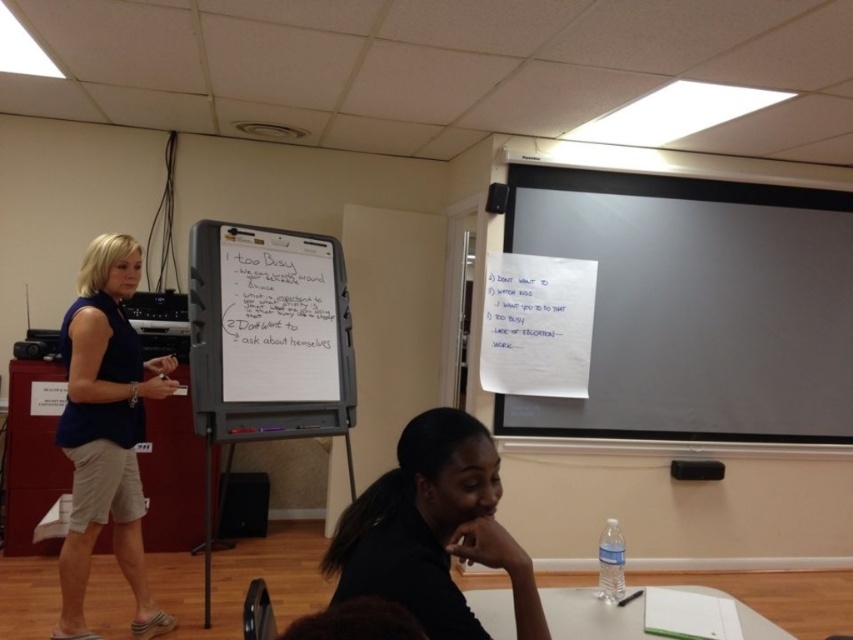
Question: Can you confirm if whiteboard at center is positioned above white paper at lower center?

Choices:
 (A) no
 (B) yes

Answer: (B)

Question: Which point appears closest to the camera in this image?

Choices:
 (A) (657, 403)
 (B) (490, 561)
 (C) (97, 520)
 (D) (496, 627)

Answer: (B)

Question: Which object is the farthest from the black matte shirt at lower center?

Choices:
 (A) white matte projection screen at upper right
 (B) whiteboard at center
 (C) white paper at lower center
 (D) blue cotton shirt at center

Answer: (A)

Question: Is white matte projection screen at upper right above white paper at lower center?

Choices:
 (A) yes
 (B) no

Answer: (A)

Question: Can you confirm if black matte shirt at lower center is positioned above white paper at lower center?

Choices:
 (A) no
 (B) yes

Answer: (B)

Question: Based on their relative distances, which object is farther from the white paper at lower center?

Choices:
 (A) white matte projection screen at upper right
 (B) whiteboard at center
 (C) blue cotton shirt at center

Answer: (A)